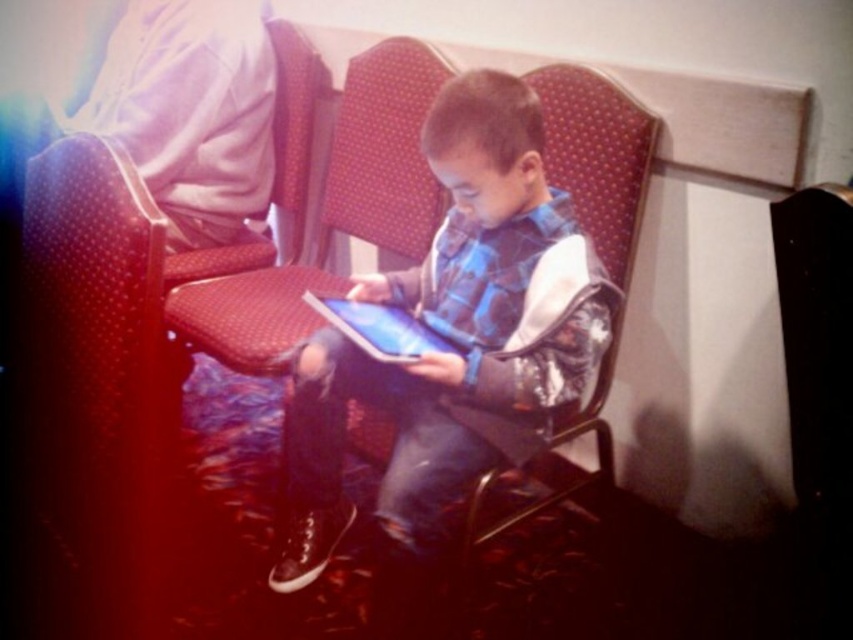
Between matte black tablet at center and matte red chair at center, which one has less height?

matte red chair at center

Is matte black tablet at center positioned behind matte red chair at center?

No.

This screenshot has width=853, height=640. In order to click on matte black tablet at center in this screenshot , I will do `click(379, 328)`.

Who is positioned more to the left, matte blue hoodie at center or matte red chair at center?

matte red chair at center

Does matte blue hoodie at center have a greater width compared to matte red chair at center?

Yes.

Locate an element on the screen. The height and width of the screenshot is (640, 853). matte blue hoodie at center is located at coordinates click(454, 336).

In the scene shown: Does matte blue hoodie at center come in front of matte black tablet at center?

That is True.

What do you see at coordinates (454, 336) in the screenshot? Image resolution: width=853 pixels, height=640 pixels. I see `matte blue hoodie at center` at bounding box center [454, 336].

Between point (492, 304) and point (386, 333), which one is positioned in front?

Point (386, 333)

Where is `matte blue hoodie at center`? The height and width of the screenshot is (640, 853). matte blue hoodie at center is located at coordinates (454, 336).